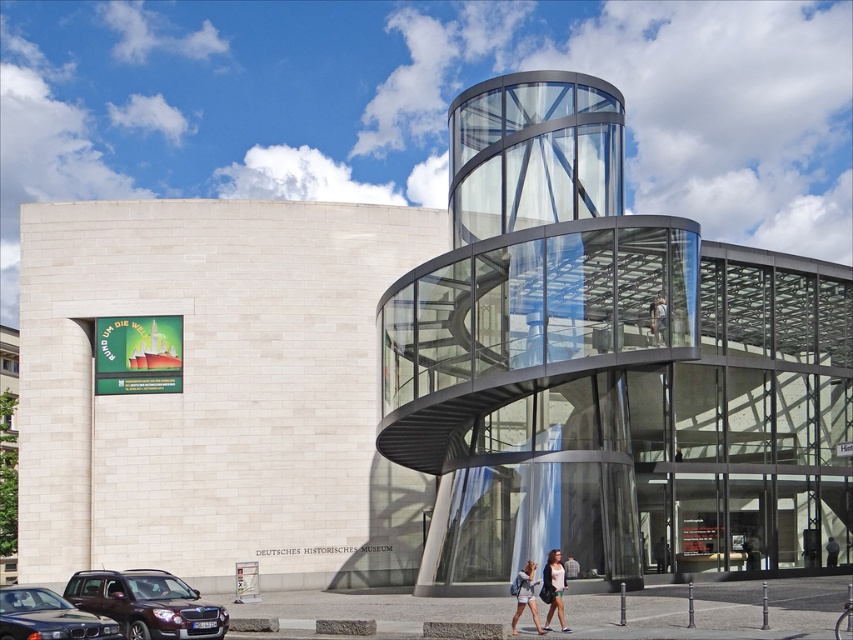
Can you confirm if matte brown suv at lower left is positioned to the left of denim jacket at lower center?

Correct, you'll find matte brown suv at lower left to the left of denim jacket at lower center.

Does matte brown suv at lower left lie behind denim jacket at lower center?

Yes, matte brown suv at lower left is behind denim jacket at lower center.

Is point (152, 609) closer to camera compared to point (524, 566)?

Yes, it is.

Locate an element on the screen. The image size is (853, 640). matte brown suv at lower left is located at coordinates (146, 604).

Is matte black car at lower left in front of denim shorts at lower center?

Yes, it is.

Is point (26, 605) more distant than point (518, 614)?

No, (26, 605) is in front of (518, 614).

Identify the location of matte black car at lower left. This screenshot has width=853, height=640. (48, 618).

Can you confirm if matte black car at lower left is taller than light brown leather jacket at center?

Incorrect, matte black car at lower left's height is not larger of light brown leather jacket at center's.

Is point (38, 608) closer to camera compared to point (660, 321)?

Yes.

This screenshot has width=853, height=640. Identify the location of matte black car at lower left. (48, 618).